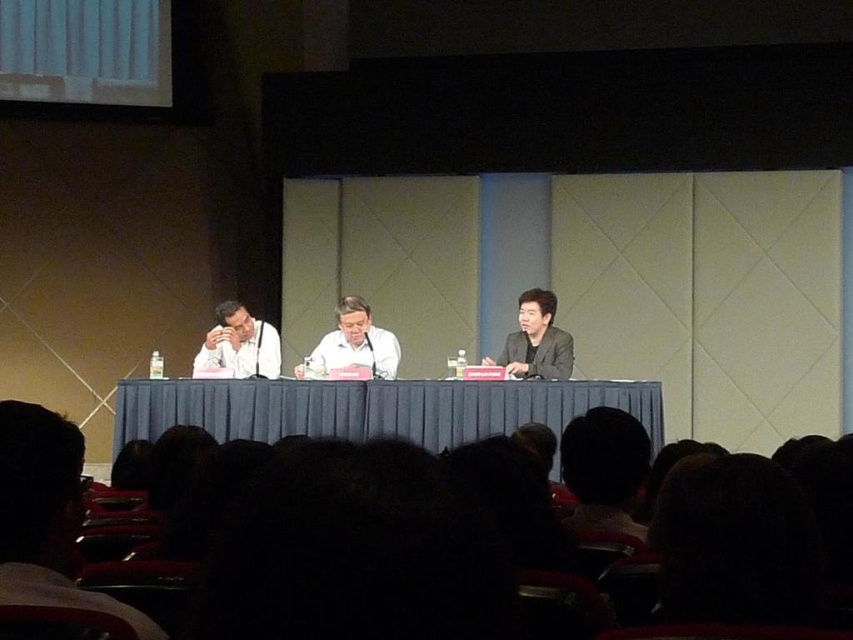
Is blue fabric table at center bigger than matte white shirt at left?

Correct, blue fabric table at center is larger in size than matte white shirt at left.

Does blue fabric table at center have a smaller size compared to matte white shirt at left?

No.

This screenshot has height=640, width=853. What do you see at coordinates (370, 406) in the screenshot?
I see `blue fabric table at center` at bounding box center [370, 406].

You are a GUI agent. You are given a task and a screenshot of the screen. Output one action in this format:
    pyautogui.click(x=<x>, y=<y>)
    Task: Click on the blue fabric table at center
    
    Given the screenshot: What is the action you would take?
    pyautogui.click(x=370, y=406)

Can you confirm if blue fabric table at center is shorter than smooth white shirt at center?

Yes.

At what (x,y) coordinates should I click in order to perform the action: click on blue fabric table at center. Please return your answer as a coordinate pair (x, y). Looking at the image, I should click on (370, 406).

Which is in front, point (215, 326) or point (349, 326)?

Point (349, 326)

Is point (215, 332) positioned behind point (373, 348)?

That is True.

The width and height of the screenshot is (853, 640). What do you see at coordinates (239, 344) in the screenshot? I see `matte white shirt at left` at bounding box center [239, 344].

The height and width of the screenshot is (640, 853). Find the location of `matte white shirt at left`. matte white shirt at left is located at coordinates (239, 344).